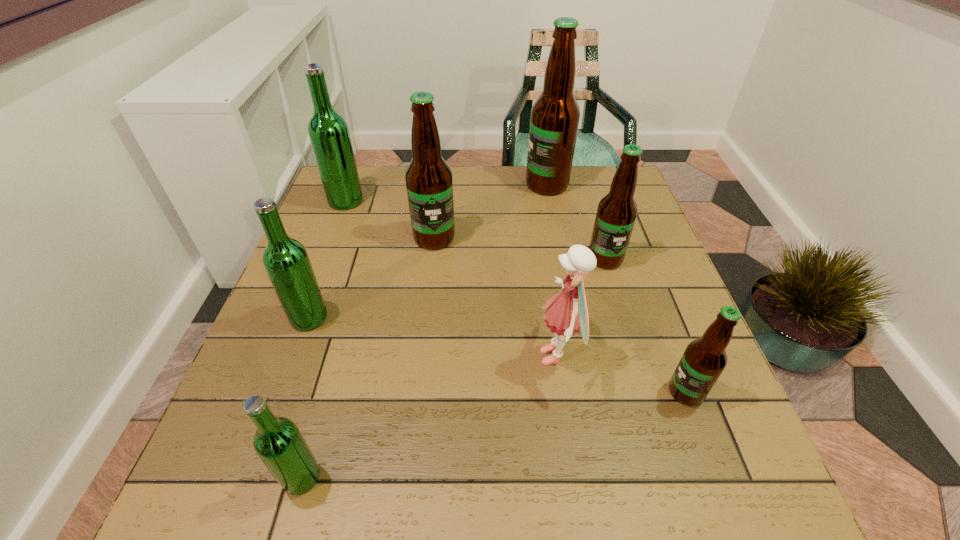
Locate an element on the screen. The width and height of the screenshot is (960, 540). free space between the biggest green beer bottle and the doll is located at coordinates (451, 279).

You are a GUI agent. You are given a task and a screenshot of the screen. Output one action in this format:
    pyautogui.click(x=<x>, y=<y>)
    Task: Click on the unoccupied position between the smallest green beer bottle and the farthest brown beer bottle
    This screenshot has height=540, width=960.
    Given the screenshot: What is the action you would take?
    pyautogui.click(x=424, y=331)

At what (x,y) coordinates should I click in order to perform the action: click on free point between the sixth farthest beer bottle and the second smallest brown beer bottle. Please return your answer as a coordinate pair (x, y). This screenshot has width=960, height=540. Looking at the image, I should click on (645, 325).

Where is `vacant area that lies between the second smallest brown beer bottle and the second nearest beer bottle`? This screenshot has width=960, height=540. vacant area that lies between the second smallest brown beer bottle and the second nearest beer bottle is located at coordinates (645, 325).

The height and width of the screenshot is (540, 960). Find the location of `object that is the second closest to the smallest brown beer bottle`. object that is the second closest to the smallest brown beer bottle is located at coordinates (617, 211).

This screenshot has width=960, height=540. Identify the location of object that is the fourth closest one to the third biggest brown beer bottle. (429, 184).

At what (x,y) coordinates should I click in order to perform the action: click on the third closest beer bottle to the second biggest brown beer bottle. Please return your answer as a coordinate pair (x, y). Looking at the image, I should click on (554, 121).

Locate an element on the screen. beer bottle that is the third closest to the second nearest green beer bottle is located at coordinates (328, 131).

Find the location of a particular element. Image resolution: width=960 pixels, height=540 pixels. brown beer bottle object that ranks as the second closest to the third biggest brown beer bottle is located at coordinates (703, 361).

Point out which brown beer bottle is positioned as the second nearest to the sixth farthest beer bottle. Please provide its 2D coordinates. Your answer should be formatted as a tuple, i.e. [(x, y)], where the tuple contains the x and y coordinates of a point satisfying the conditions above.

[(429, 184)]